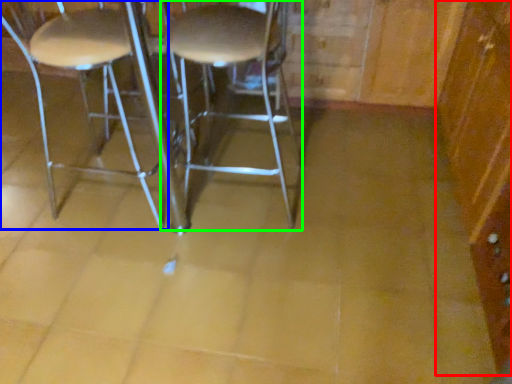
Question: Considering the real-world distances, which object is farthest from dresser (highlighted by a red box)? chair (highlighted by a blue box) or stool (highlighted by a green box)?

Choices:
 (A) chair
 (B) stool

Answer: (A)